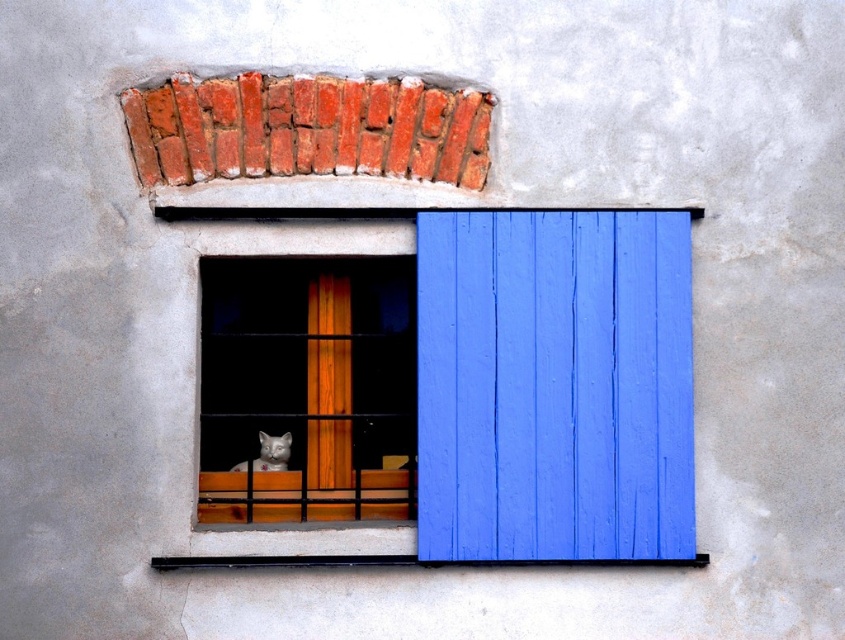
Is blue painted wood at right positioned before white fur cat at window center?

Yes, blue painted wood at right is in front of white fur cat at window center.

Who is higher up, blue painted wood at right or white fur cat at window center?

blue painted wood at right is above.

The height and width of the screenshot is (640, 845). What do you see at coordinates (554, 385) in the screenshot? I see `blue painted wood at right` at bounding box center [554, 385].

Identify the location of blue painted wood at right. (554, 385).

Who is more forward, [331,516] or [277,456]?

Point [331,516] is in front.

Measure the distance from white glossy cat at center to white fur cat at window center.

The distance of white glossy cat at center from white fur cat at window center is 23.42 centimeters.

Image resolution: width=845 pixels, height=640 pixels. What do you see at coordinates (308, 387) in the screenshot? I see `white glossy cat at center` at bounding box center [308, 387].

Identify the location of white glossy cat at center. click(x=308, y=387).

Between point (687, 380) and point (306, 516), which one is positioned behind?

The point (306, 516) is behind.

Image resolution: width=845 pixels, height=640 pixels. What do you see at coordinates (554, 385) in the screenshot?
I see `blue painted wood at right` at bounding box center [554, 385].

Locate an element on the screen. The width and height of the screenshot is (845, 640). blue painted wood at right is located at coordinates (554, 385).